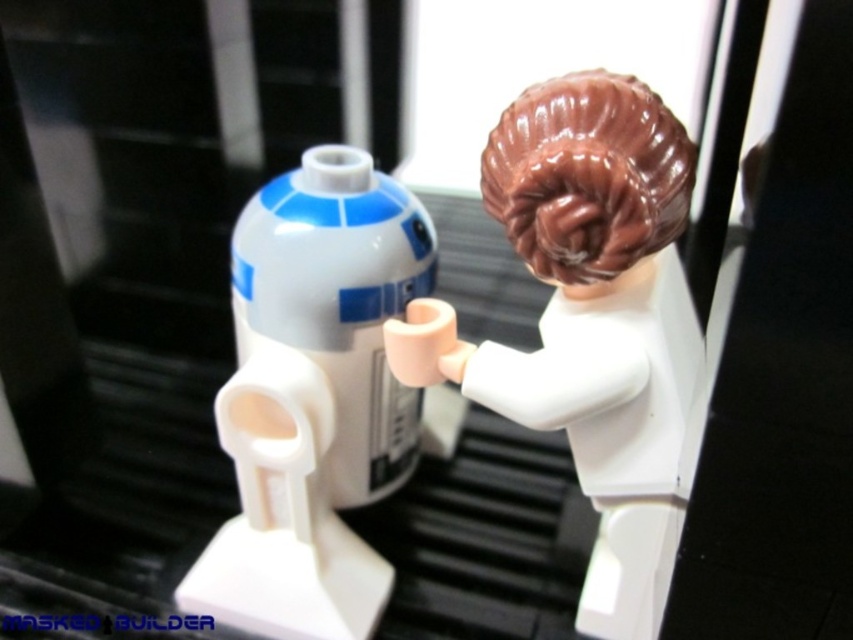
You are standing in front of a LEGO display. There is a point at coordinates [590,320]. What object is located at that point?

The point at coordinates [590,320] has brown glossy hair at upper center.